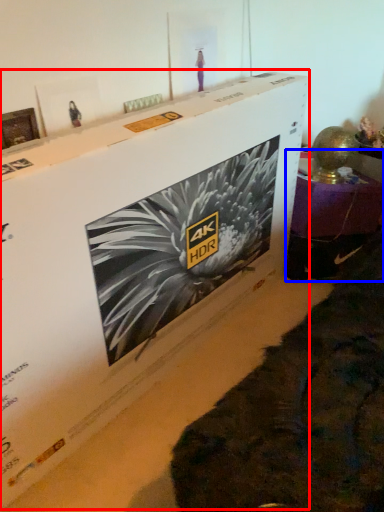
Question: Which object appears closest to the camera in this image, cardboard box (highlighted by a red box) or furniture (highlighted by a blue box)?

Choices:
 (A) cardboard box
 (B) furniture

Answer: (A)